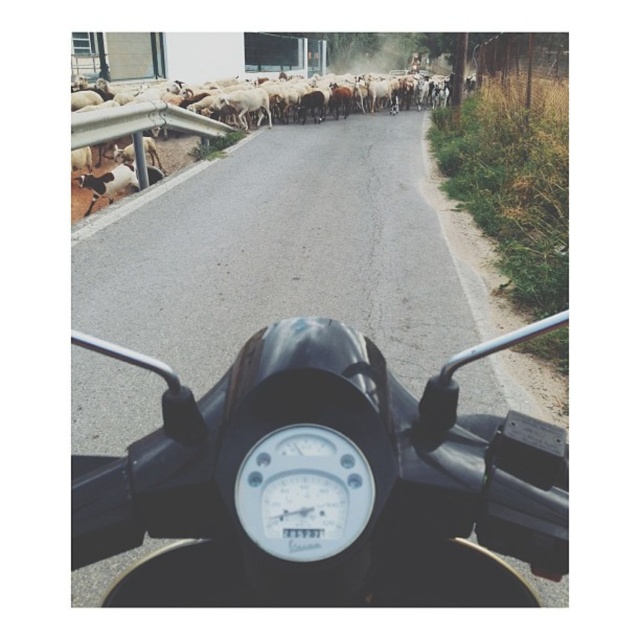
As you ride the black matte motorcycle at center, you notice a white woolen sheep at upper left in the distance. Which object is positioned higher in the image?

The white woolen sheep at upper left is positioned higher in the image than the black matte motorcycle at center.

As you ride your motorcycle, you notice a point marked at coordinates (323,476). Which object does this point correspond to?

The point at coordinates (323,476) corresponds to the black matte motorcycle at center.

You are riding a black matte motorcycle at center and see a white woolen sheep at upper left in your view. Which direction should you turn to avoid the sheep?

You should turn to the left because the black matte motorcycle at center is to the right of the white woolen sheep at upper left, meaning the sheep is on your left side. Turning left would move you away from the sheep.